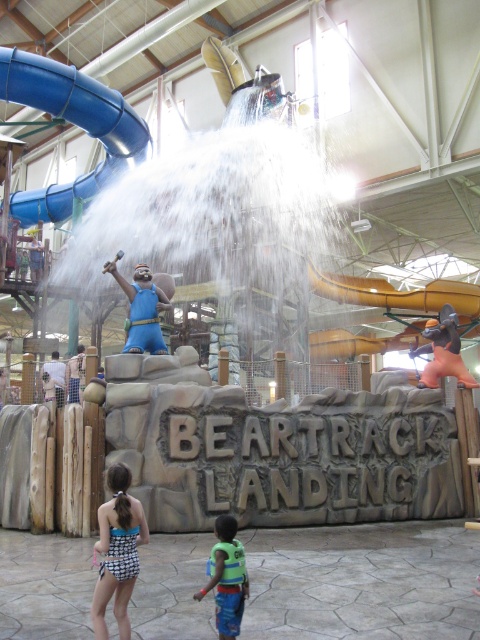
Based on the photo, you are a guest at Beartrack Landing and want to take a photo of the blue fabric statue at center while avoiding getting your blue and white checkered swimsuit at lower left in the shot. Is this possible?

The blue and white checkered swimsuit at lower left is below the blue fabric statue at center, so you can position yourself to frame the statue without the swimsuit appearing in the shot by angling the camera upwards.

Looking at this image, you are designing a layout for a new water park and need to place the blue rubber slide at upper left and the blue fabric statue at center. Given their sizes, which object should be placed in a more prominent location to ensure visibility?

The blue rubber slide at upper left is bigger than the blue fabric statue at center, so it should be placed in a more prominent location to ensure visibility.

You are standing at the entrance of Beartrack Landing and want to reach the blue rubber slide at upper left. The park requires visitors to stay at least 20 meters away from all water slides for safety. Is your current position compliant with this rule?

The distance between you and the blue rubber slide at upper left is 20.38 meters, which is just over the required 20 meters. Therefore, your current position complies with the safety rule.